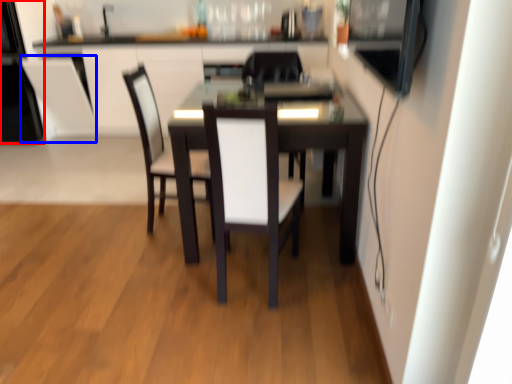
Question: Which point is further to the camera, appliance (highlighted by a red box) or armchair (highlighted by a blue box)?

Choices:
 (A) appliance
 (B) armchair

Answer: (B)